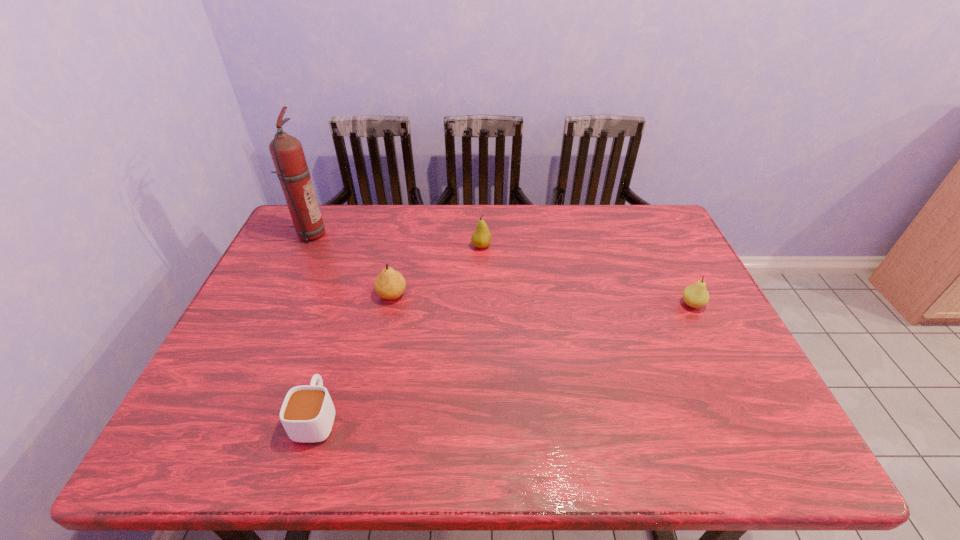
This screenshot has width=960, height=540. Identify the location of the leftmost object. (286, 151).

This screenshot has width=960, height=540. In order to click on fire extinguisher in this screenshot , I will do `click(286, 151)`.

Identify the location of the second pear from right to left. The width and height of the screenshot is (960, 540). (481, 238).

The image size is (960, 540). Identify the location of the farthest pear. (481, 238).

Locate an element on the screen. The image size is (960, 540). the leftmost pear is located at coordinates (390, 284).

Identify the location of the rightmost pear. (696, 295).

Where is `the rightmost object`? This screenshot has height=540, width=960. the rightmost object is located at coordinates (696, 295).

Where is `cup`? This screenshot has height=540, width=960. cup is located at coordinates (307, 414).

Find the location of `the fourth object from right to left`. the fourth object from right to left is located at coordinates (307, 414).

This screenshot has width=960, height=540. Find the location of `vacant region located on the side of the tallest object with the label and nozzle`. vacant region located on the side of the tallest object with the label and nozzle is located at coordinates (412, 234).